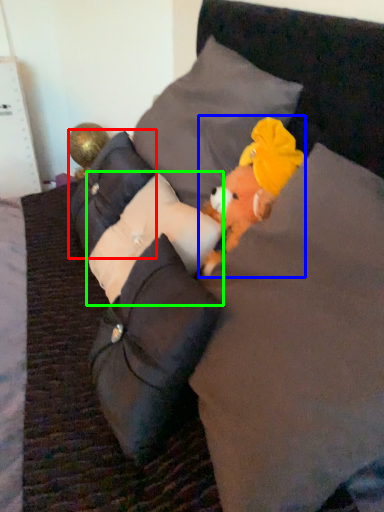
Question: Which is farther away from pillow (highlighted by a red box)? toy (highlighted by a blue box) or pillow (highlighted by a green box)?

Choices:
 (A) toy
 (B) pillow

Answer: (A)